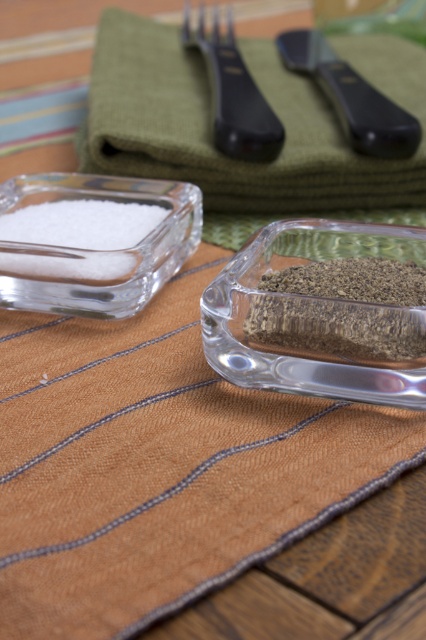
Question: Which of these objects is positioned farthest from the black plastic fork at upper center?

Choices:
 (A) dark brown granular spice at center
 (B) white crystalline salt at left
 (C) black plastic knife at upper center
 (D) green fabric napkin at upper center

Answer: (A)

Question: Which of these objects is positioned closest to the dark brown granular spice at center?

Choices:
 (A) white crystalline salt at left
 (B) green fabric napkin at upper center
 (C) black plastic fork at upper center

Answer: (A)

Question: Is white crystalline salt at left further to camera compared to black plastic knife at upper center?

Choices:
 (A) no
 (B) yes

Answer: (A)

Question: Does green fabric napkin at upper center have a smaller size compared to dark brown granular spice at center?

Choices:
 (A) no
 (B) yes

Answer: (A)

Question: Which of the following is the farthest from the observer?

Choices:
 (A) black plastic knife at upper center
 (B) dark brown granular spice at center

Answer: (A)

Question: Does green fabric napkin at upper center appear on the left side of black plastic knife at upper center?

Choices:
 (A) yes
 (B) no

Answer: (A)